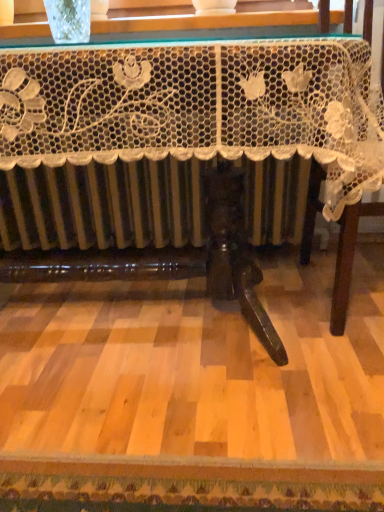
Question: Does white lace tablecloth at right contain white lace tablecloth at center?

Choices:
 (A) no
 (B) yes

Answer: (A)

Question: Is white lace tablecloth at right to the left of white lace tablecloth at center from the viewer's perspective?

Choices:
 (A) yes
 (B) no

Answer: (B)

Question: Is white lace tablecloth at right not within white lace tablecloth at center?

Choices:
 (A) no
 (B) yes

Answer: (B)

Question: Considering the relative positions of white lace tablecloth at right and white lace tablecloth at center in the image provided, is white lace tablecloth at right behind white lace tablecloth at center?

Choices:
 (A) yes
 (B) no

Answer: (A)

Question: From the image's perspective, is white lace tablecloth at right located beneath white lace tablecloth at center?

Choices:
 (A) yes
 (B) no

Answer: (B)

Question: From a real-world perspective, does white lace tablecloth at right sit lower than white lace tablecloth at center?

Choices:
 (A) yes
 (B) no

Answer: (B)

Question: Is white lace tablecloth at right at the back of white lace tablecloth at center?

Choices:
 (A) no
 (B) yes

Answer: (A)

Question: Is white lace tablecloth at center wider than white lace tablecloth at right?

Choices:
 (A) yes
 (B) no

Answer: (A)

Question: Can you confirm if white lace tablecloth at center is bigger than white lace tablecloth at right?

Choices:
 (A) yes
 (B) no

Answer: (A)

Question: Does white lace tablecloth at center have a lesser width compared to white lace tablecloth at right?

Choices:
 (A) yes
 (B) no

Answer: (B)

Question: From the image's perspective, is white lace tablecloth at center above white lace tablecloth at right?

Choices:
 (A) no
 (B) yes

Answer: (A)

Question: Does white lace tablecloth at center have a smaller size compared to white lace tablecloth at right?

Choices:
 (A) no
 (B) yes

Answer: (A)

Question: Relative to white lace tablecloth at center, is white lace tablecloth at right in front or behind?

Choices:
 (A) front
 (B) behind

Answer: (B)